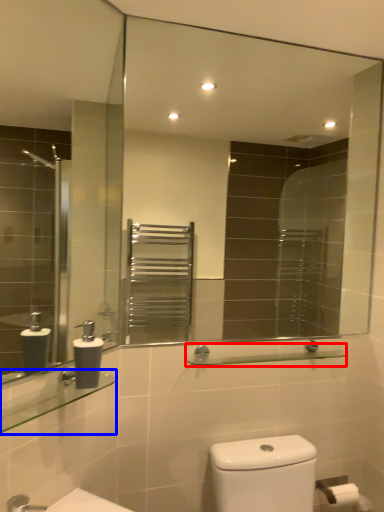
Question: Which object is closer to the camera taking this photo, balustrade (highlighted by a red box) or balustrade (highlighted by a blue box)?

Choices:
 (A) balustrade
 (B) balustrade

Answer: (B)